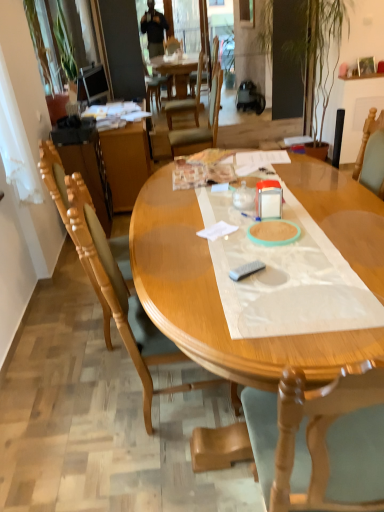
I want to click on vacant region to the right of metallic silver container at center, so click(x=302, y=210).